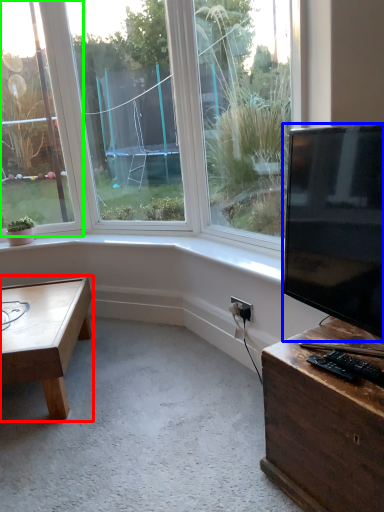
Question: Which object is positioned closest to coffee table (highlighted by a red box)? Select from television (highlighted by a blue box) and window (highlighted by a green box).

Choices:
 (A) television
 (B) window

Answer: (B)